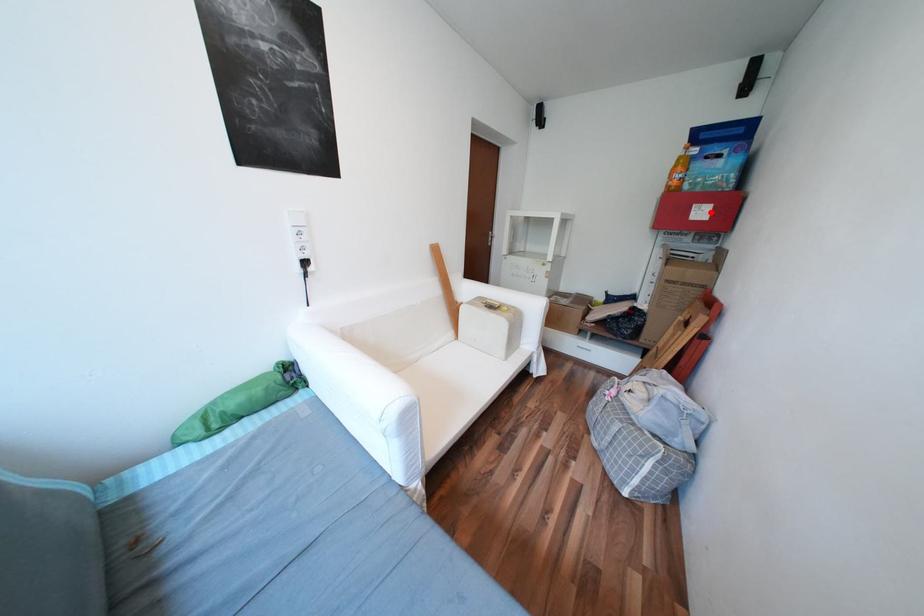
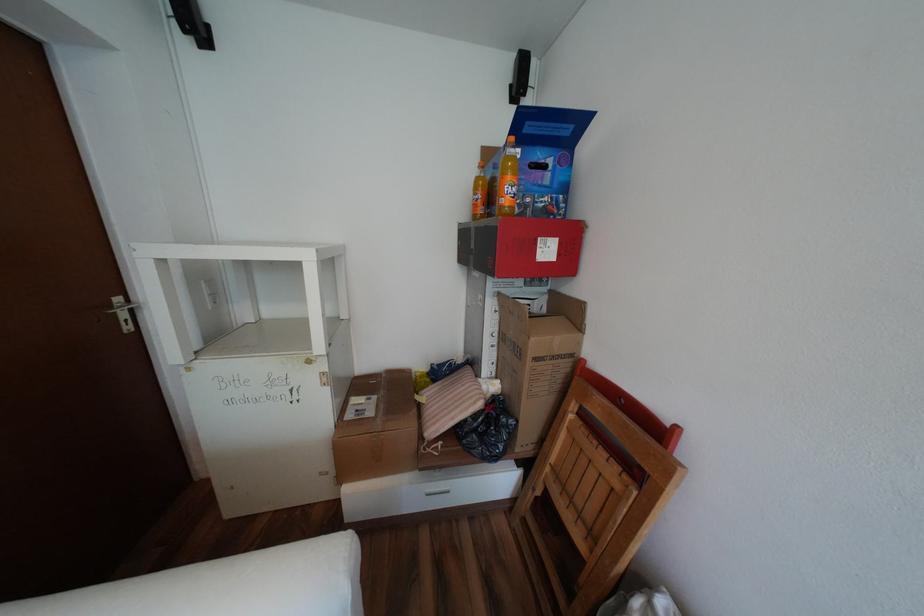
Locate, in the second image, the point that corresponds to the highlighted location in the first image.

(556, 251)